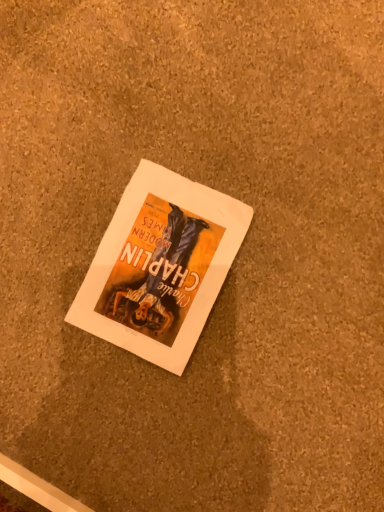
What do you see at coordinates (160, 266) in the screenshot?
I see `matte paper book at center` at bounding box center [160, 266].

I want to click on matte paper book at center, so click(160, 266).

Find the location of a particular element. This screenshot has width=384, height=512. matte paper book at center is located at coordinates (160, 266).